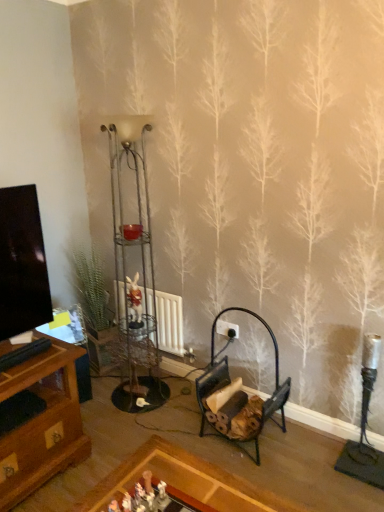
Measure the distance between point (x=163, y=506) and camera.

The depth of point (x=163, y=506) is 1.29 meters.

Image resolution: width=384 pixels, height=512 pixels. I want to click on black metal firewood rack at lower center, so click(229, 382).

Identify the location of white matte radiator at center. (170, 323).

In order to face white matte radiator at center, should I rotate leftwards or rightwards?

To face it directly, rotate left by 4.262 degrees.

This screenshot has height=512, width=384. Find the location of `white glossy rabbit at center, the 1th toy viewed from the top`. white glossy rabbit at center, the 1th toy viewed from the top is located at coordinates (134, 302).

Does white matte radiator at center have a lesser width compared to white plastic toy at center, which is the 2th toy from top to bottom?

In fact, white matte radiator at center might be wider than white plastic toy at center, which is the 2th toy from top to bottom.

What's the angular difference between white matte radiator at center and white plastic toy at center, which appears as the first toy when viewed from the right,'s facing directions?

The angular difference between white matte radiator at center and white plastic toy at center, which appears as the first toy when viewed from the right, is 88.1 degrees.

From a real-world perspective, which object stands above the other?

white plastic toy at center, which is the 2th toy in left-to-right order, is physically above.

Is white matte radiator at center spatially inside white plastic toy at center, which appears as the first toy when viewed from the right, or outside of it?

white matte radiator at center cannot be found inside white plastic toy at center, which appears as the first toy when viewed from the right.

From the image's perspective, who appears lower, black metal firewood rack at lower center or white matte radiator at center?

black metal firewood rack at lower center is shown below in the image.

Choose the correct answer: Is black metal firewood rack at lower center inside white matte radiator at center or outside it?

black metal firewood rack at lower center cannot be found inside white matte radiator at center.

From the picture: From a real-world perspective, which is physically below, black metal firewood rack at lower center or white matte radiator at center?

In real-world perspective, white matte radiator at center is lower.

In the image, there is a white glossy rabbit at center, which is the first toy in left-to-right order. Where is `radiator below it (from a real-world perspective)`? The image size is (384, 512). radiator below it (from a real-world perspective) is located at coordinates (170, 323).

How much distance is there between white glossy rabbit at center, which is the first toy in left-to-right order, and white matte radiator at center?

23.16 centimeters.

Is white matte radiator at center inside white glossy rabbit at center, which is the second toy from bottom to top?

No, white matte radiator at center is located outside of white glossy rabbit at center, which is the second toy from bottom to top.

From the image's perspective, is white glossy rabbit at center, marked as the 2th toy in a front-to-back arrangement, below white matte radiator at center?

No, from the image's perspective, white glossy rabbit at center, marked as the 2th toy in a front-to-back arrangement, is not below white matte radiator at center.

From a real-world perspective, relative to black metal firewood rack at lower center, is white plastic toy at center, which is the 2th toy in left-to-right order, vertically above or below?

From a real-world perspective, white plastic toy at center, which is the 2th toy in left-to-right order, is physically above black metal firewood rack at lower center.

Is white plastic toy at center, marked as the first toy in a bottom-to-top arrangement, not inside black metal firewood rack at lower center?

white plastic toy at center, marked as the first toy in a bottom-to-top arrangement, lies outside black metal firewood rack at lower center's area.

From the image's perspective, which one is positioned lower, white plastic toy at center, which appears as the first toy when viewed from the right, or black metal firewood rack at lower center?

white plastic toy at center, which appears as the first toy when viewed from the right, from the image's perspective.

Which is more to the left, white plastic toy at center, arranged as the first toy when viewed from the front, or black metal firewood rack at lower center?

white plastic toy at center, arranged as the first toy when viewed from the front, is more to the left.

Does white matte radiator at center have a smaller size compared to black metal firewood rack at lower center?

Indeed, white matte radiator at center has a smaller size compared to black metal firewood rack at lower center.

The width and height of the screenshot is (384, 512). In order to click on radiator behind the black metal firewood rack at lower center in this screenshot , I will do 170,323.

Is white matte radiator at center not close to black metal firewood rack at lower center?

No, white matte radiator at center is in close proximity to black metal firewood rack at lower center.

From a real-world perspective, is white matte radiator at center positioned above or below black metal firewood rack at lower center?

From a real-world perspective, white matte radiator at center is physically below black metal firewood rack at lower center.

From a real-world perspective, relative to white glossy rabbit at center, which is the first toy in left-to-right order, is black metal firewood rack at lower center vertically above or below?

black metal firewood rack at lower center is situated lower than white glossy rabbit at center, which is the first toy in left-to-right order, in the real world.

What's the angular difference between black metal firewood rack at lower center and white glossy rabbit at center, marked as the 2th toy in a front-to-back arrangement,'s facing directions?

56.9 degrees.

Is black metal firewood rack at lower center bigger than white glossy rabbit at center, acting as the first toy starting from the back?

Indeed, black metal firewood rack at lower center has a larger size compared to white glossy rabbit at center, acting as the first toy starting from the back.

Which object is closer to the camera taking this photo, white matte radiator at center or white glossy rabbit at center, marked as the 2th toy in a front-to-back arrangement?

white glossy rabbit at center, marked as the 2th toy in a front-to-back arrangement, is closer to the camera.

Image resolution: width=384 pixels, height=512 pixels. I want to click on toy that is the 1st one when counting forward from the white matte radiator at center, so tap(134, 302).

Looking at this image, from a real-world perspective, is white matte radiator at center physically located above or below white glossy rabbit at center, the 2th toy viewed from the right?

In terms of real-world spatial position, white matte radiator at center is below white glossy rabbit at center, the 2th toy viewed from the right.

Does white matte radiator at center turn towards white glossy rabbit at center, the 2th toy viewed from the right?

Yes, white matte radiator at center is facing white glossy rabbit at center, the 2th toy viewed from the right.

Where is `toy below the white matte radiator at center (from the image's perspective)`? toy below the white matte radiator at center (from the image's perspective) is located at coordinates (162, 496).

Where is `rocking chair lying on the right of white matte radiator at center`? rocking chair lying on the right of white matte radiator at center is located at coordinates (229, 382).

Looking at the image, which one is located further to white matte radiator at center, black metal firewood rack at lower center or white plastic toy at center, which appears as the first toy when viewed from the right?

The object further to white matte radiator at center is white plastic toy at center, which appears as the first toy when viewed from the right.

When comparing their distances from black metal firewood rack at lower center, does white plastic toy at center, which is the 2th toy in left-to-right order, or white matte radiator at center seem closer?

white matte radiator at center.

Looking at the image, which one is located further to white plastic toy at center, arranged as the first toy when viewed from the front, white glossy rabbit at center, marked as the 2th toy in a front-to-back arrangement, or white matte radiator at center?

Among the two, white matte radiator at center is located further to white plastic toy at center, arranged as the first toy when viewed from the front.

From the image, which object appears to be farther from white plastic toy at center, arranged as the first toy when viewed from the front, white glossy rabbit at center, marked as the 2th toy in a front-to-back arrangement, or black metal firewood rack at lower center?

white glossy rabbit at center, marked as the 2th toy in a front-to-back arrangement, is further to white plastic toy at center, arranged as the first toy when viewed from the front.

Based on their spatial positions, is black metal firewood rack at lower center or white matte radiator at center closer to white glossy rabbit at center, which is the second toy from bottom to top?

Based on the image, white matte radiator at center appears to be nearer to white glossy rabbit at center, which is the second toy from bottom to top.

From the picture: Which object lies further to the anchor point black metal firewood rack at lower center, white glossy rabbit at center, which is the first toy in left-to-right order, or white matte radiator at center?

white glossy rabbit at center, which is the first toy in left-to-right order, is positioned further to the anchor black metal firewood rack at lower center.

Consider the image. Estimate the real-world distances between objects in this image. Which object is further from white plastic toy at center, marked as the first toy in a bottom-to-top arrangement, white matte radiator at center or white glossy rabbit at center, marked as the 2th toy in a front-to-back arrangement?

Among the two, white matte radiator at center is located further to white plastic toy at center, marked as the first toy in a bottom-to-top arrangement.

Which object lies nearer to the anchor point black metal firewood rack at lower center, white matte radiator at center or white glossy rabbit at center, the 2th toy viewed from the right?

white matte radiator at center is closer to black metal firewood rack at lower center.

The width and height of the screenshot is (384, 512). What are the coordinates of `toy between black metal firewood rack at lower center and white matte radiator at center along the z-axis` in the screenshot? It's located at (134, 302).

Locate an element on the screen. This screenshot has height=512, width=384. rocking chair located between white plastic toy at center, marked as the first toy in a bottom-to-top arrangement, and white matte radiator at center in the depth direction is located at coordinates (229, 382).

Find the location of a particular element. Image resolution: width=384 pixels, height=512 pixels. rocking chair positioned between white plastic toy at center, which is the 2th toy in left-to-right order, and white glossy rabbit at center, acting as the first toy starting from the back, from near to far is located at coordinates (229, 382).

Identify the location of toy between white plastic toy at center, which is the 2th toy from top to bottom, and white matte radiator at center, along the z-axis. (134, 302).